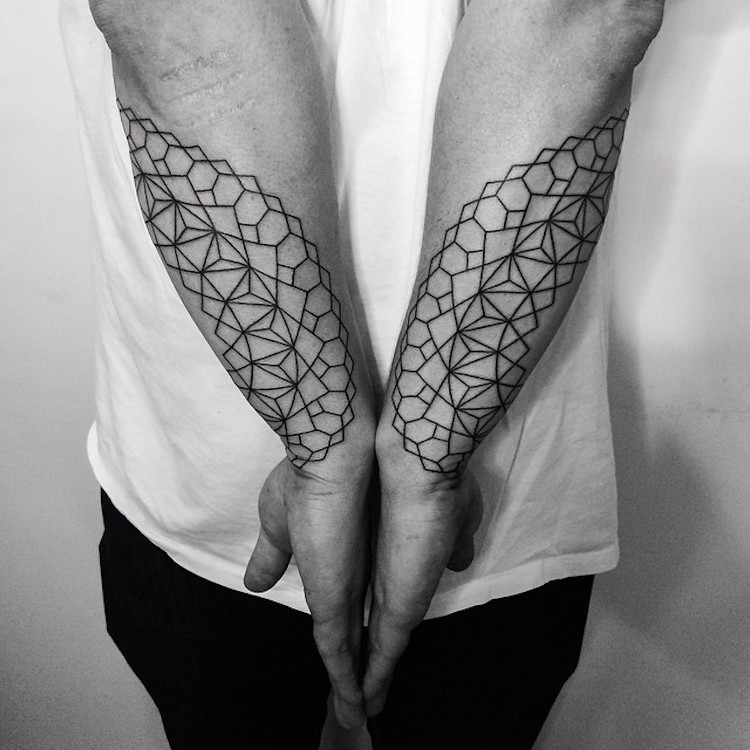
The width and height of the screenshot is (750, 750). In order to click on wall in this screenshot , I will do `click(32, 465)`.